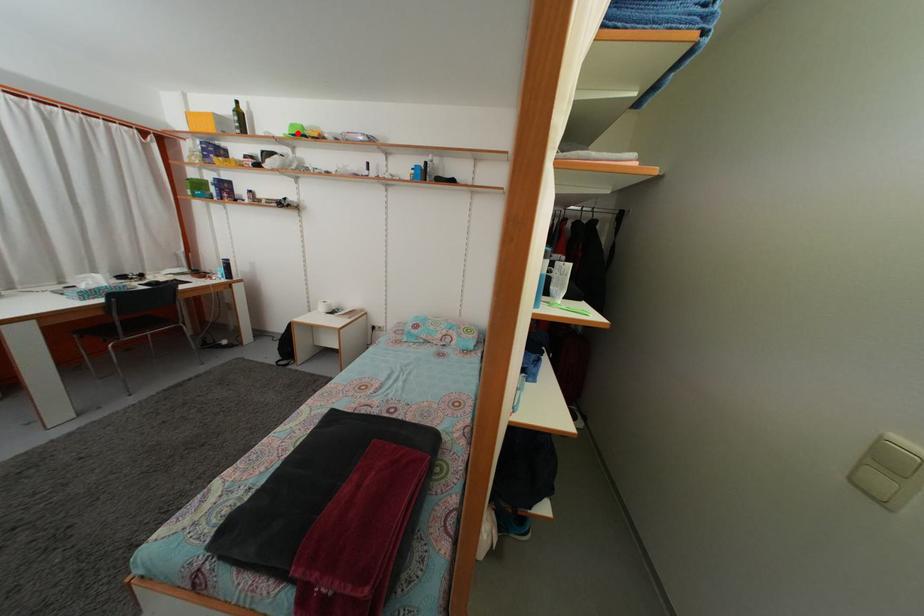
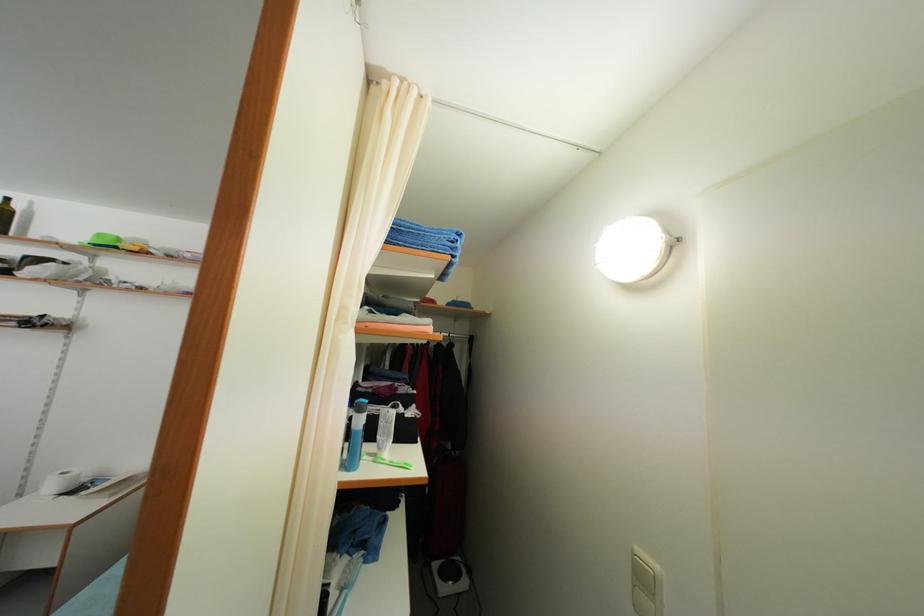
Locate, in the second image, the point that corresponds to the highlighted location in the first image.

(104, 243)